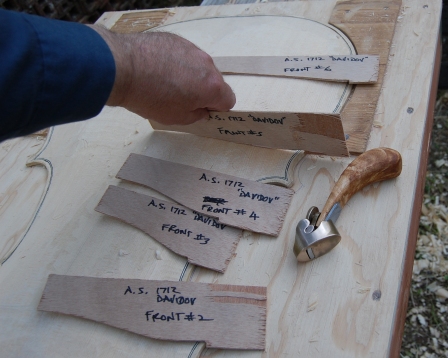
The width and height of the screenshot is (448, 358). I want to click on wood work table, so click(375, 313).